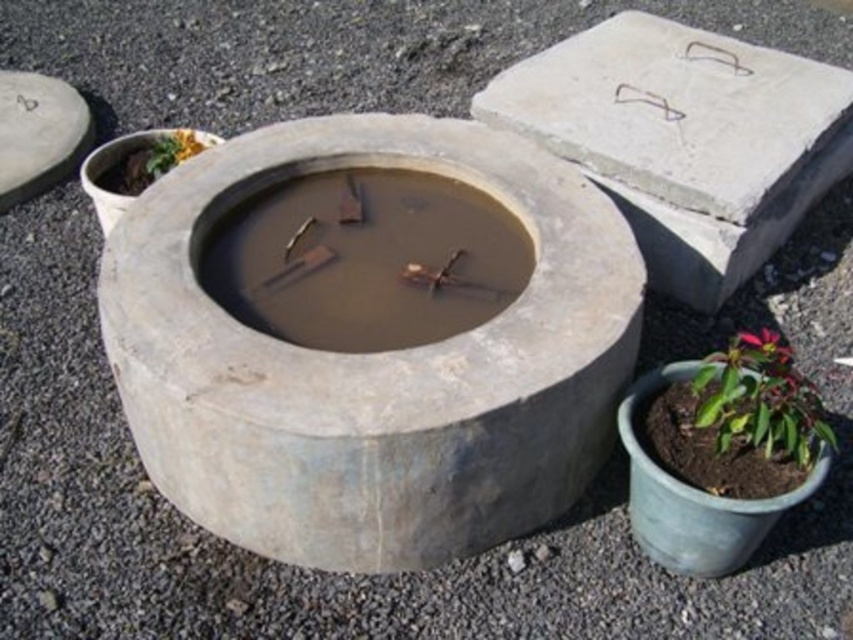
Who is more distant from viewer, [682,52] or [16,84]?

Positioned behind is point [16,84].

Find the location of a particular element. This screenshot has width=853, height=640. smooth concrete slab at upper right is located at coordinates (685, 140).

Identify the location of smooth concrete slab at upper right. The width and height of the screenshot is (853, 640). (685, 140).

Is point (772, 417) more distant than point (776, 337)?

No, (772, 417) is in front of (776, 337).

Measure the distance between green glossy plant at lower right and camera.

green glossy plant at lower right and camera are 7.74 feet apart from each other.

Where is `green glossy plant at lower right`? The image size is (853, 640). green glossy plant at lower right is located at coordinates (759, 401).

Based on the photo, can you confirm if smooth concrete slab at upper right is taller than green leafy plant at upper left?

Yes.

Does smooth concrete slab at upper right appear under green leafy plant at upper left?

No.

Does point (581, 100) come behind point (158, 164)?

Yes, it is behind point (158, 164).

This screenshot has height=640, width=853. Identify the location of smooth concrete slab at upper right. (685, 140).